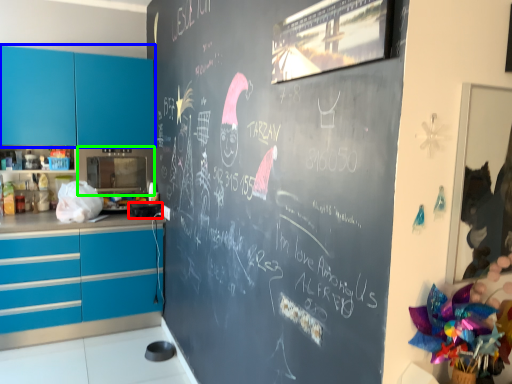
Question: Estimate the real-world distances between objects in this image. Which object is closer to appliance (highlighted by a red box), cabinetry (highlighted by a blue box) or appliance (highlighted by a green box)?

Choices:
 (A) cabinetry
 (B) appliance

Answer: (B)